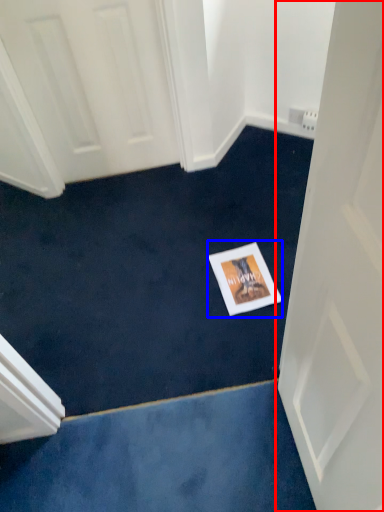
Question: Which object appears farthest to the camera in this image, door (highlighted by a red box) or postcard (highlighted by a blue box)?

Choices:
 (A) door
 (B) postcard

Answer: (B)